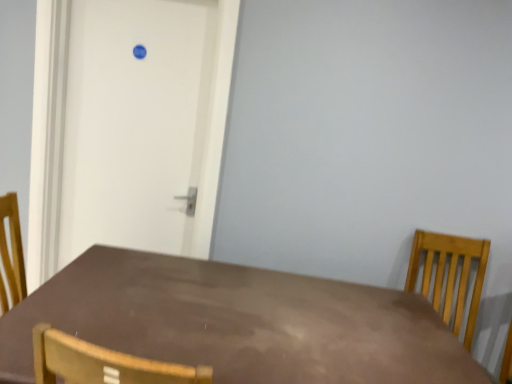
This screenshot has height=384, width=512. Identify the location of light brown wooden chair at right. (449, 275).

Describe the element at coordinates (238, 323) in the screenshot. I see `brown matte table at center` at that location.

At what (x,y) coordinates should I click in order to perform the action: click on white matte door at upper left. Please return your answer as a coordinate pair (x, y). The image size is (512, 384). Looking at the image, I should click on (136, 124).

At what (x,y) coordinates should I click in order to perform the action: click on light brown wooden chair at right. Please return your answer as a coordinate pair (x, y). The height and width of the screenshot is (384, 512). Looking at the image, I should click on (449, 275).

From the image's perspective, does light brown wooden chair at right appear lower than brown matte table at center?

No, from the image's perspective, light brown wooden chair at right is not beneath brown matte table at center.

Is light brown wooden chair at right surrounding brown matte table at center?

Definitely not — brown matte table at center is not inside light brown wooden chair at right.

Consider the image. Between light brown wooden chair at right and brown matte table at center, which one has smaller width?

Thinner between the two is light brown wooden chair at right.

This screenshot has width=512, height=384. What are the coordinates of `table in front of the light brown wooden chair at right` in the screenshot? It's located at (238, 323).

Based on the photo, are brown matte table at center and white matte door at upper left beside each other?

brown matte table at center is not next to white matte door at upper left, and they're not touching.

Is brown matte table at center closer to camera compared to white matte door at upper left?

Yes, the depth of brown matte table at center is less than that of white matte door at upper left.

Is point (439, 336) closer or farther from the camera than point (116, 195)?

Point (439, 336) is positioned closer to the camera compared to point (116, 195).

From a real-world perspective, which object stands above the other?

From a 3D spatial view, white matte door at upper left is above.

Does light brown wooden chair at right touch white matte door at upper left?

No, light brown wooden chair at right is not beside white matte door at upper left.

Is light brown wooden chair at right bigger than white matte door at upper left?

Correct, light brown wooden chair at right is larger in size than white matte door at upper left.

From the picture: Considering the relative sizes of light brown wooden chair at right and white matte door at upper left in the image provided, is light brown wooden chair at right wider than white matte door at upper left?

Yes, light brown wooden chair at right is wider than white matte door at upper left.

Is point (487, 257) positioned behind point (158, 118)?

That is False.

Which object is thinner, white matte door at upper left or brown matte table at center?

Thinner between the two is white matte door at upper left.

Choose the correct answer: Is white matte door at upper left inside brown matte table at center or outside it?

white matte door at upper left is spatially situated outside brown matte table at center.

Considering the positions of point (330, 283) and point (481, 249), is point (330, 283) closer or farther from the camera than point (481, 249)?

Clearly, point (330, 283) is closer to the camera than point (481, 249).

Which object is thinner, brown matte table at center or light brown wooden chair at right?

light brown wooden chair at right is thinner.

Between brown matte table at center and light brown wooden chair at right, which one is positioned behind?

light brown wooden chair at right.

Is white matte door at upper left at the left side of light brown wooden chair at right?

Yes, white matte door at upper left is to the left of light brown wooden chair at right.

Considering the relative sizes of white matte door at upper left and light brown wooden chair at right in the image provided, is white matte door at upper left bigger than light brown wooden chair at right?

Incorrect, white matte door at upper left is not larger than light brown wooden chair at right.

From their relative heights in the image, would you say white matte door at upper left is taller or shorter than light brown wooden chair at right?

white matte door at upper left is taller than light brown wooden chair at right.

This screenshot has height=384, width=512. I want to click on chair that is behind the brown matte table at center, so click(x=449, y=275).

The image size is (512, 384). In order to click on table located on the right of white matte door at upper left in this screenshot , I will do `click(238, 323)`.

From the image, which object appears to be farther from white matte door at upper left, light brown wooden chair at right or brown matte table at center?

light brown wooden chair at right.

Estimate the real-world distances between objects in this image. Which object is further from light brown wooden chair at right, brown matte table at center or white matte door at upper left?

white matte door at upper left lies further to light brown wooden chair at right than the other object.

Looking at the image, which one is located closer to white matte door at upper left, brown matte table at center or light brown wooden chair at right?

Among the two, brown matte table at center is located nearer to white matte door at upper left.

From the image, which object appears to be nearer to brown matte table at center, white matte door at upper left or light brown wooden chair at right?

white matte door at upper left is closer to brown matte table at center.

Based on their spatial positions, is white matte door at upper left or brown matte table at center closer to light brown wooden chair at right?

Based on the image, brown matte table at center appears to be nearer to light brown wooden chair at right.

Looking at the image, which one is located closer to brown matte table at center, light brown wooden chair at right or white matte door at upper left?

white matte door at upper left is closer to brown matte table at center.

Identify the location of table between white matte door at upper left and light brown wooden chair at right. This screenshot has width=512, height=384. (238, 323).